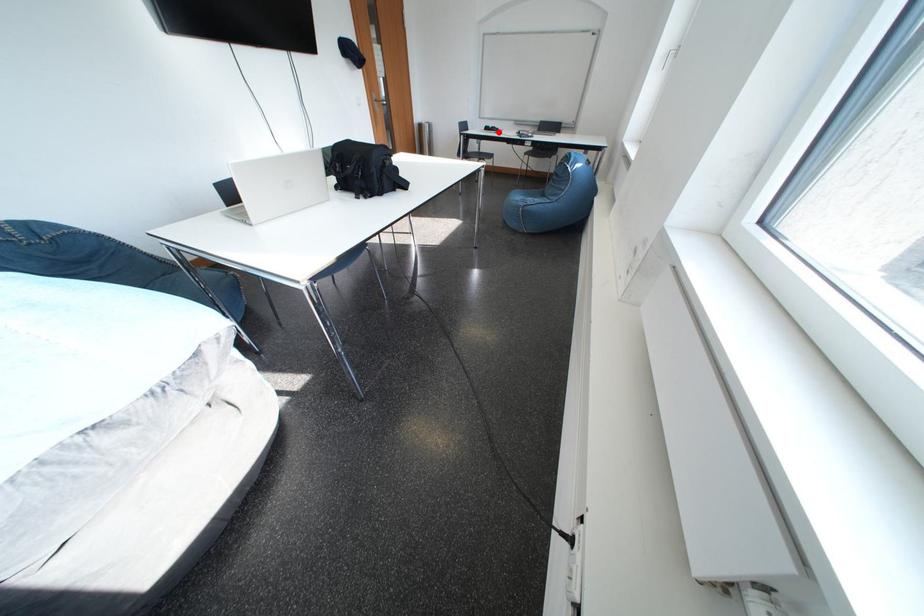
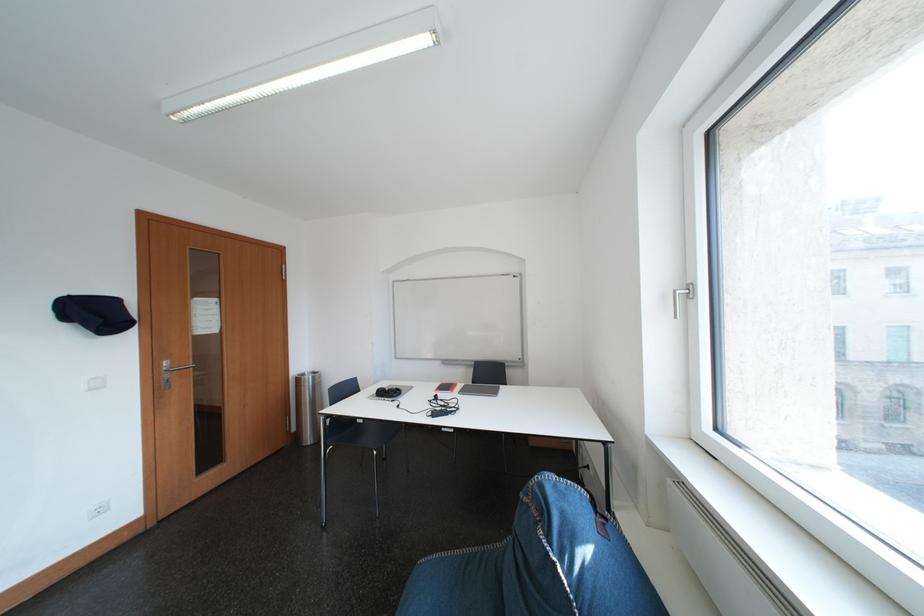
In the second image, find the point that corresponds to the highlighted location in the first image.

(393, 395)